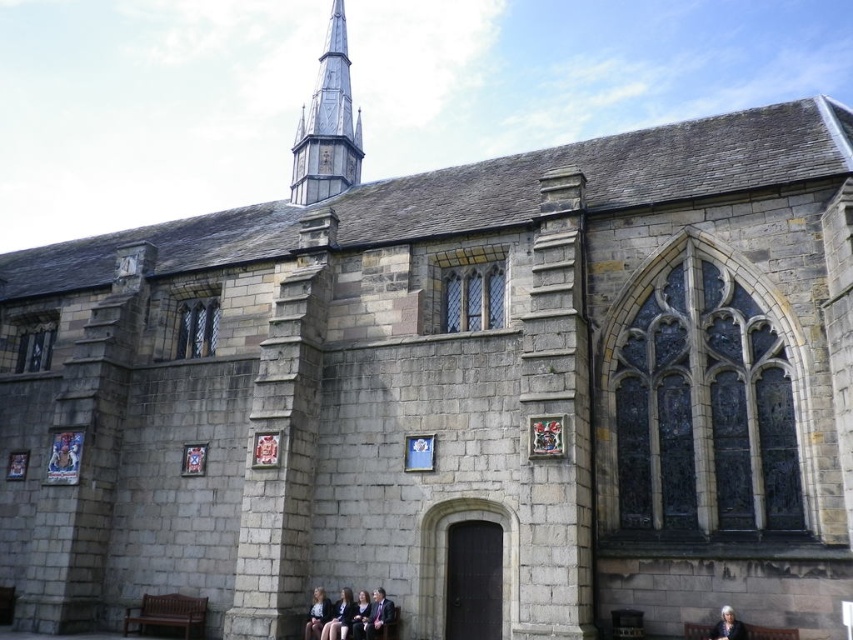
The image size is (853, 640). Describe the element at coordinates (328, 125) in the screenshot. I see `gray stone spire at upper center` at that location.

Does gray stone spire at upper center lie in front of formal suit at lower center?

No, gray stone spire at upper center is further to the viewer.

Which is in front, point (346, 170) or point (383, 593)?

Positioned in front is point (383, 593).

Identify the location of gray stone spire at upper center. The image size is (853, 640). 328,125.

Does brown wooden bench at lower left have a larger size compared to smooth skin face at lower center?

No, brown wooden bench at lower left is not bigger than smooth skin face at lower center.

Can you confirm if brown wooden bench at lower left is smaller than smooth skin face at lower center?

Yes, brown wooden bench at lower left is smaller than smooth skin face at lower center.

Describe the element at coordinates (167, 614) in the screenshot. I see `brown wooden bench at lower left` at that location.

What are the coordinates of `brown wooden bench at lower left` in the screenshot? It's located at (167, 614).

Can you confirm if smooth skin face at lower center is smaller than light brown leather jacket at lower center?

Incorrect, smooth skin face at lower center is not smaller in size than light brown leather jacket at lower center.

Measure the distance between point (332, 634) and camera.

A distance of 37.86 meters exists between point (332, 634) and camera.

You are a GUI agent. You are given a task and a screenshot of the screen. Output one action in this format:
    pyautogui.click(x=<x>, y=<y>)
    Task: Click on the smooth skin face at lower center
    
    Given the screenshot: What is the action you would take?
    pyautogui.click(x=339, y=618)